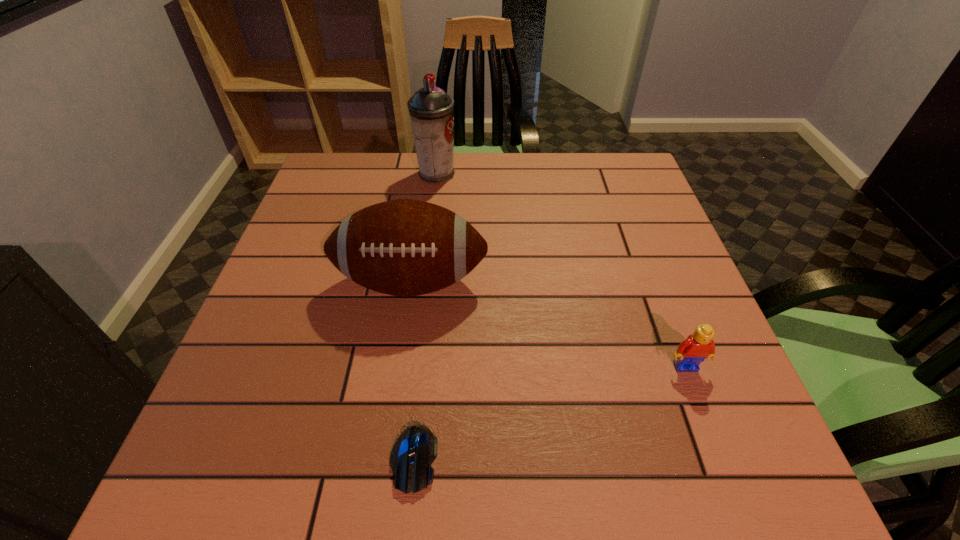
Find the location of a particular element. Image resolution: width=960 pixels, height=540 pixels. free space located on the front-facing side of the third tallest object is located at coordinates (732, 489).

Locate an element on the screen. object present at the far edge is located at coordinates (431, 110).

Identify the location of object at the near edge. The image size is (960, 540). (414, 451).

Find the location of a particular element. Image resolution: width=960 pixels, height=540 pixels. object that is at the left edge is located at coordinates (404, 247).

This screenshot has height=540, width=960. What are the coordinates of `object at the right edge` in the screenshot? It's located at (692, 351).

At what (x,y) coordinates should I click in order to perform the action: click on free space at the far edge of the desktop. Please return your answer as a coordinate pair (x, y). This screenshot has height=540, width=960. Looking at the image, I should click on (492, 160).

At what (x,y) coordinates should I click in order to perform the action: click on vacant space at the near edge of the desktop. Please return your answer as a coordinate pair (x, y). The width and height of the screenshot is (960, 540). Looking at the image, I should click on (468, 465).

In the image, there is a desktop. Identify the location of vacant space at the left edge. (250, 340).

In the image, there is a desktop. Identify the location of free space at the right edge. (623, 212).

The image size is (960, 540). Identify the location of vacant area at the far left corner. (339, 166).